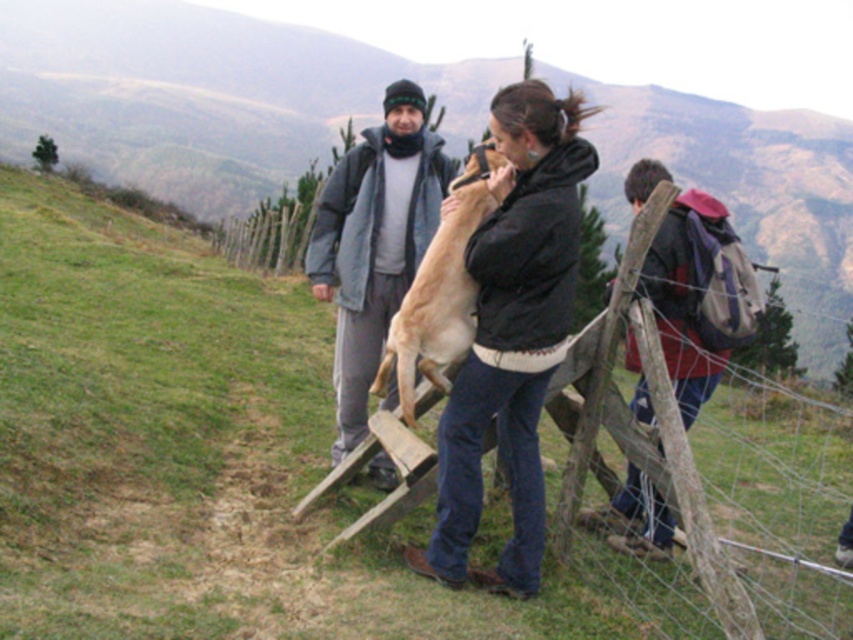
Question: Which object is the closest to the red backpack at right?

Choices:
 (A) wooden fence at center
 (B) green grass at lower left
 (C) black matte jacket at center
 (D) light brown fur at center

Answer: (C)

Question: Is black matte jacket at center wider than light brown fur at center?

Choices:
 (A) no
 (B) yes

Answer: (B)

Question: Which object is positioned closest to the wooden fence at center?

Choices:
 (A) gray fleece jacket at center
 (B) red backpack at right
 (C) light brown fur at center
 (D) black matte jacket at center

Answer: (C)

Question: Is black matte jacket at center above light brown fur at center?

Choices:
 (A) yes
 (B) no

Answer: (B)

Question: Which point is closer to the camera?

Choices:
 (A) black matte jacket at center
 (B) red backpack at right
 (C) gray fleece jacket at center

Answer: (A)

Question: Where is black matte jacket at center located in relation to red backpack at right in the image?

Choices:
 (A) below
 (B) above

Answer: (A)